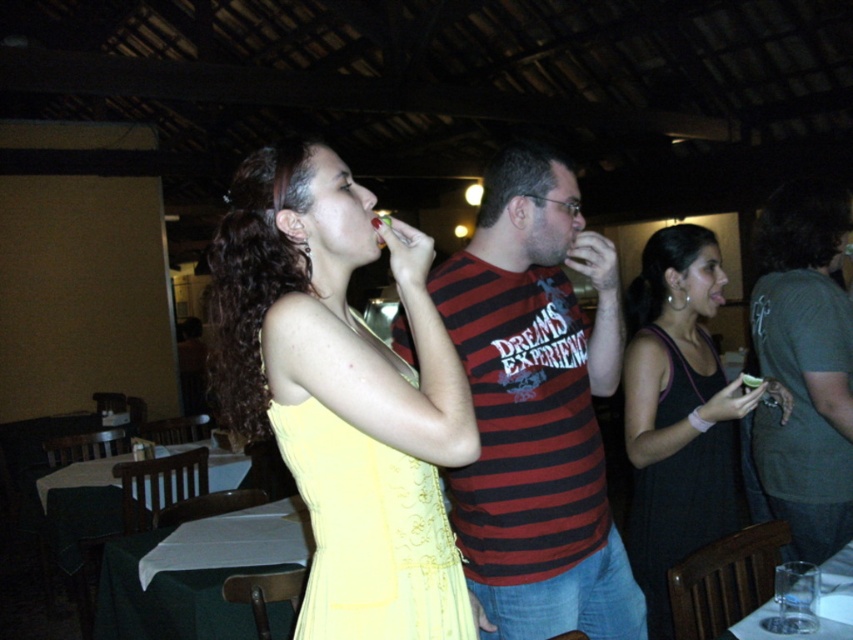
Between striped cotton shirt at center and dark gray t-shirt at right, which one appears on the right side from the viewer's perspective?

From the viewer's perspective, dark gray t-shirt at right appears more on the right side.

Who is more distant from viewer, (483, 291) or (795, 349)?

Positioned behind is point (795, 349).

Does point (578, 465) come farther from viewer compared to point (766, 504)?

No, (578, 465) is in front of (766, 504).

The image size is (853, 640). I want to click on striped cotton shirt at center, so click(537, 408).

Does yellow fabric dress at center appear over yellow satin dress at center?

Correct, yellow fabric dress at center is located above yellow satin dress at center.

Between yellow fabric dress at center and yellow satin dress at center, which one has more height?

Answer: With more height is yellow fabric dress at center.

Locate an element on the screen. Image resolution: width=853 pixels, height=640 pixels. yellow fabric dress at center is located at coordinates (466, 372).

Which is more to the left, striped cotton shirt at center or yellow satin dress at center?

yellow satin dress at center

Between point (610, 333) and point (360, 625), which one is positioned behind?

The point (610, 333) is more distant.

Image resolution: width=853 pixels, height=640 pixels. What are the coordinates of `striped cotton shirt at center` in the screenshot? It's located at (537, 408).